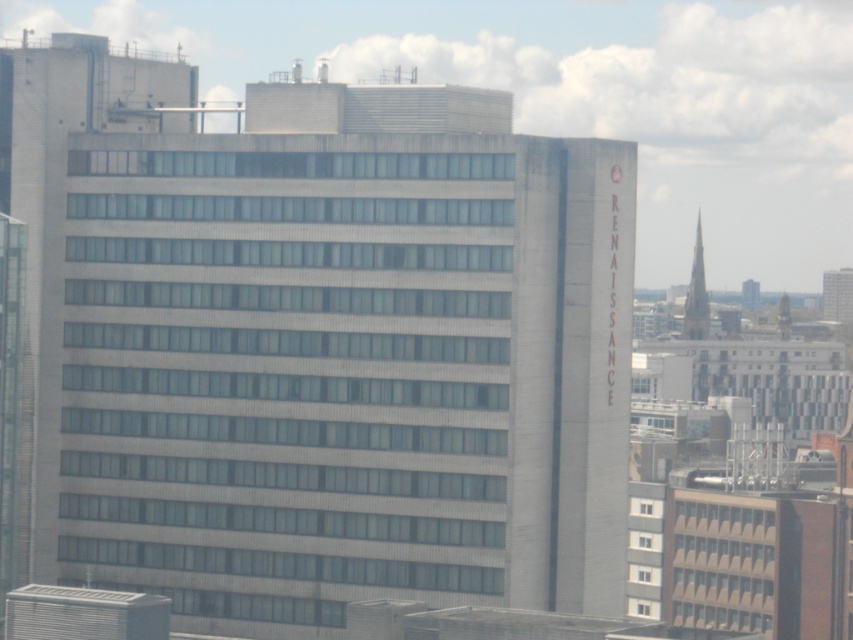
Question: Can you confirm if white concrete building at center is thinner than smooth gray steeple at upper right?

Choices:
 (A) no
 (B) yes

Answer: (A)

Question: Is white concrete building at center to the left of smooth gray steeple at upper right from the viewer's perspective?

Choices:
 (A) yes
 (B) no

Answer: (A)

Question: Is white concrete building at center above smooth gray steeple at upper right?

Choices:
 (A) yes
 (B) no

Answer: (B)

Question: Which of the following is the closest to the observer?

Choices:
 (A) (474, 448)
 (B) (693, 330)

Answer: (A)